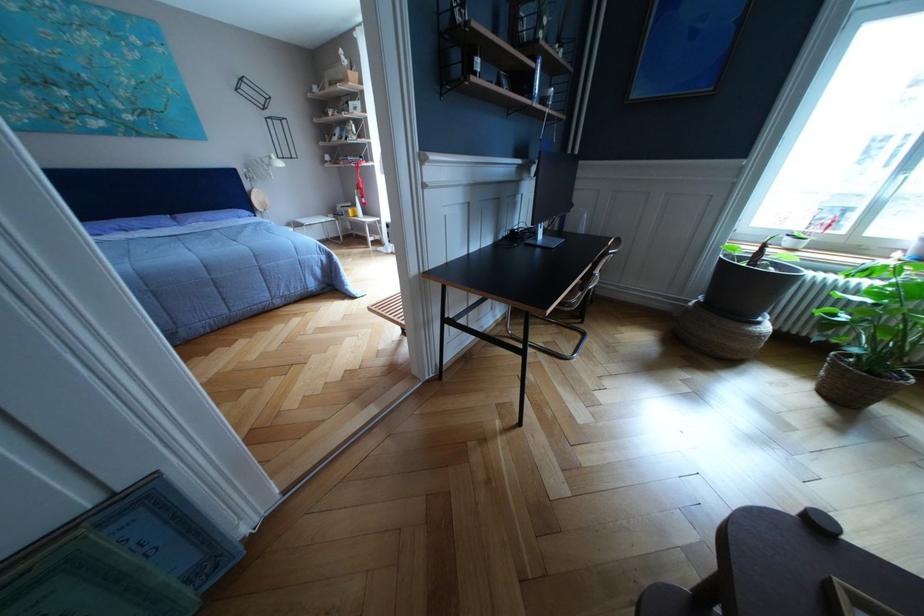
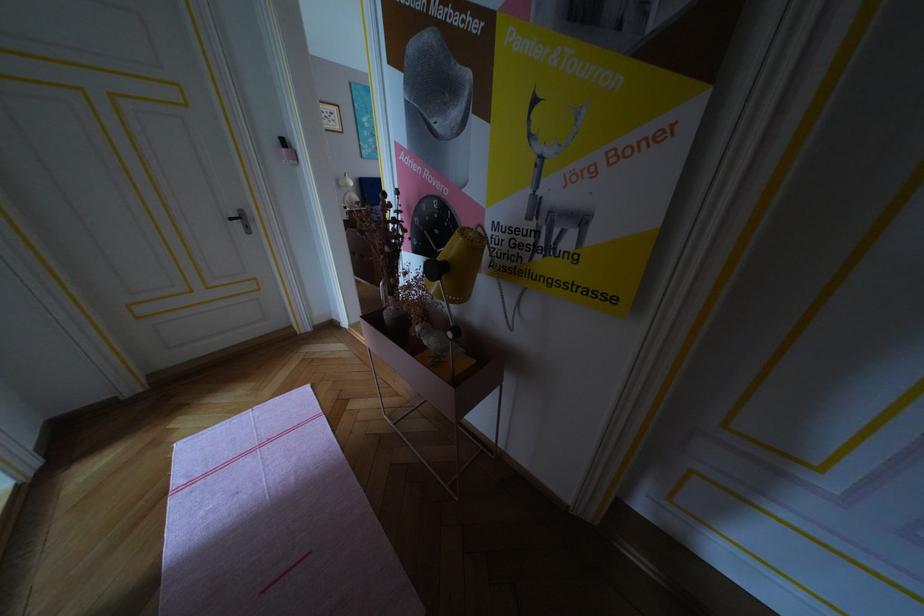
Which direction would the cameraman need to move to produce the second image?

The movement direction of the cameraman is left, backward.